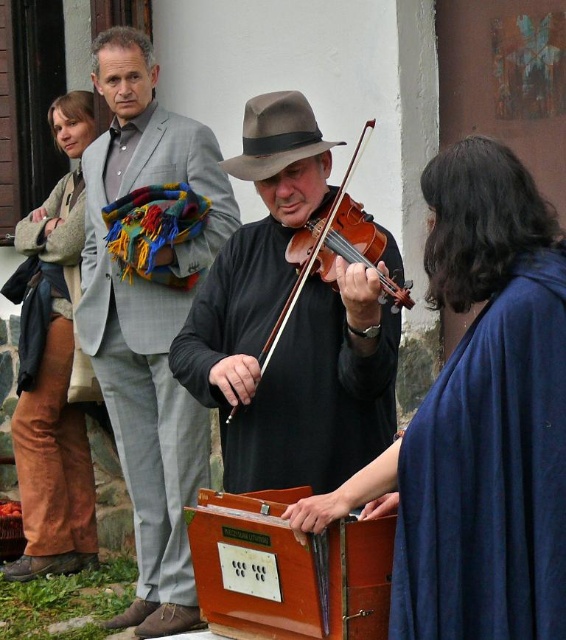
Question: Which point is farther to the camera?

Choices:
 (A) (143, 394)
 (B) (71, 518)
 (C) (400, 288)

Answer: (B)

Question: Is brown corduroy pants at left positioned before shiny brown violin at center?

Choices:
 (A) no
 (B) yes

Answer: (A)

Question: Which object is the closest to the shiny brown violin at center?

Choices:
 (A) brown corduroy pants at left
 (B) blue woolen shawl at center

Answer: (B)

Question: Is light gray suit at left thinner than brown corduroy pants at left?

Choices:
 (A) no
 (B) yes

Answer: (A)

Question: Is blue woolen shawl at center to the right of brown corduroy pants at left from the viewer's perspective?

Choices:
 (A) yes
 (B) no

Answer: (A)

Question: Among these points, which one is nearest to the camera?

Choices:
 (A) pos(85,244)
 (B) pos(494,296)
 (C) pos(78,168)
 (D) pos(508,268)

Answer: (D)